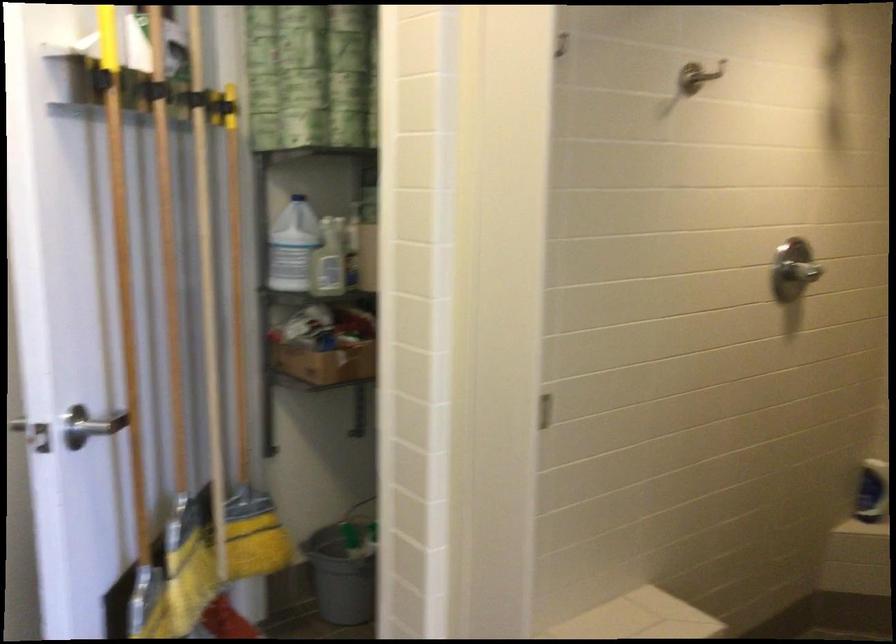
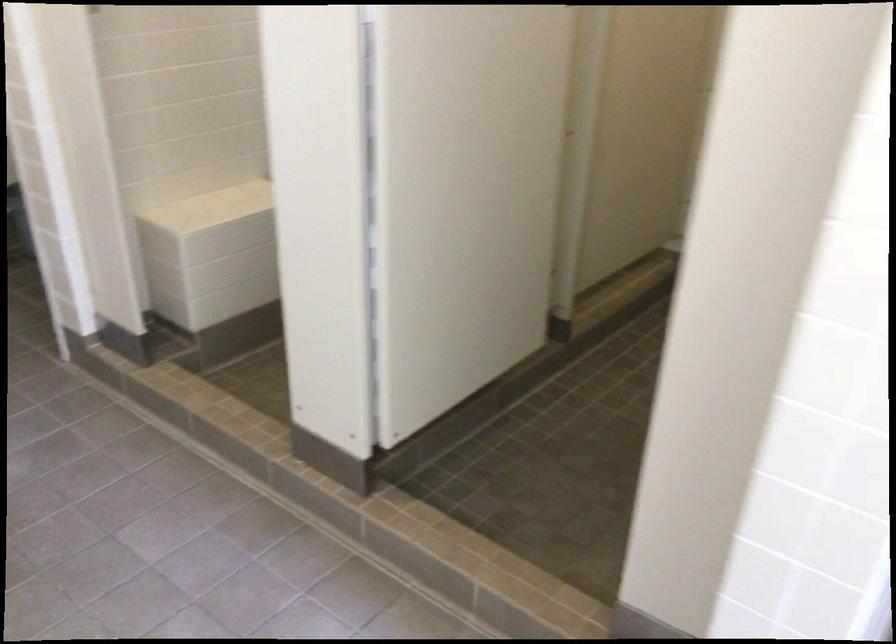
Question: The images are taken continuously from a first-person perspective. In which direction is your viewpoint rotating?

Choices:
 (A) Left
 (B) Right
 (C) Up
 (D) Down

Answer: (D)